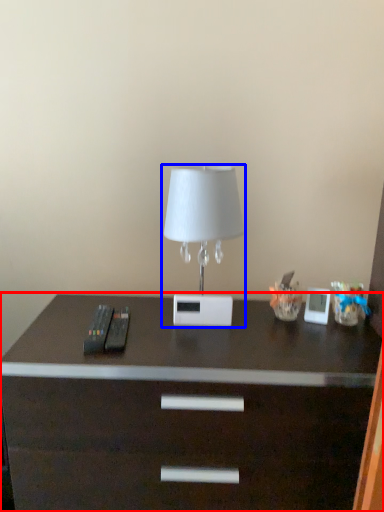
Question: Which object is further to the camera taking this photo, desk (highlighted by a red box) or lamp (highlighted by a blue box)?

Choices:
 (A) desk
 (B) lamp

Answer: (B)